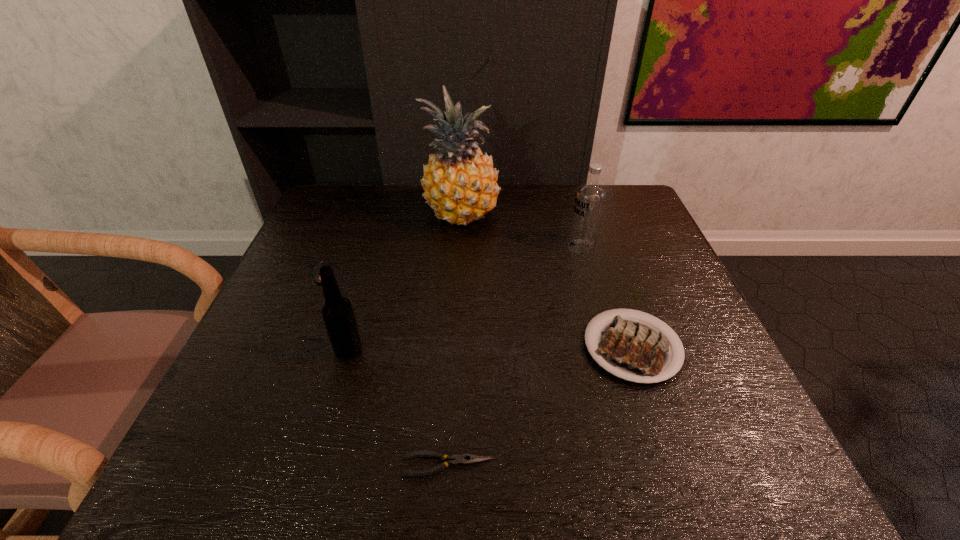
At what (x,y) coordinates should I click in order to perform the action: click on vacant point located between the vodka and the leftmost object. Please return your answer as a coordinate pair (x, y). Image resolution: width=960 pixels, height=540 pixels. Looking at the image, I should click on (452, 260).

At what (x,y) coordinates should I click in order to perform the action: click on free spot between the second object from left to right and the second farthest object. Please return your answer as a coordinate pair (x, y). Looking at the image, I should click on (465, 299).

Identify the location of free spot between the plate and the leftmost object. (478, 309).

Locate an element on the screen. This screenshot has width=960, height=540. free area in between the second farthest object and the plate is located at coordinates (607, 298).

This screenshot has height=540, width=960. I want to click on vacant area that lies between the leftmost object and the vodka, so click(x=452, y=260).

I want to click on vacant area that lies between the plate and the fifth tallest object, so click(x=478, y=309).

Identify the location of free spot between the nearest object and the vodka. This screenshot has height=540, width=960. (515, 356).

Identify which object is the fourth nearest to the nearest object. Please provide its 2D coordinates. Your answer should be formatted as a tuple, i.e. [(x, y)], where the tuple contains the x and y coordinates of a point satisfying the conditions above.

[(589, 201)]

Locate which object ranks fourth in proximity to the beer bottle. Please provide its 2D coordinates. Your answer should be formatted as a tuple, i.e. [(x, y)], where the tuple contains the x and y coordinates of a point satisfying the conditions above.

[(631, 349)]

You are a GUI agent. You are given a task and a screenshot of the screen. Output one action in this format:
    pyautogui.click(x=<x>, y=<y>)
    Task: Click on the vacant space that satisfies the following two spatial constraints: 1. on the front label of the vodka; 2. on the front side of the computer mouse
    
    Given the screenshot: What is the action you would take?
    pyautogui.click(x=588, y=272)